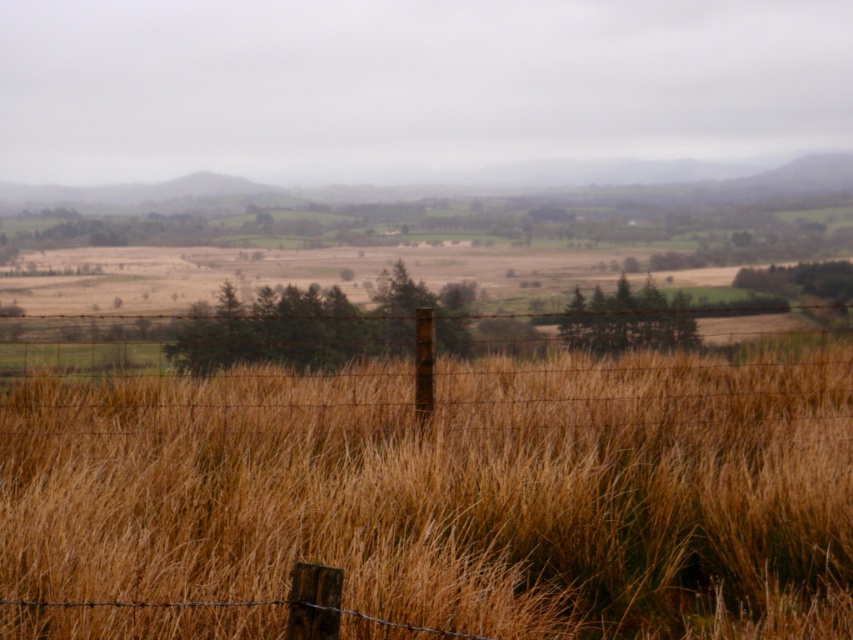
Who is higher up, brown dry grass at center or barbed wire fence at center?

Positioned higher is barbed wire fence at center.

Is brown dry grass at center shorter than barbed wire fence at center?

Yes.

Who is more distant from viewer, (526, 481) or (659, 314)?

The point (659, 314) is behind.

At what (x,y) coordinates should I click in order to perform the action: click on brown dry grass at center. Please return your answer as a coordinate pair (x, y). The height and width of the screenshot is (640, 853). Looking at the image, I should click on (451, 492).